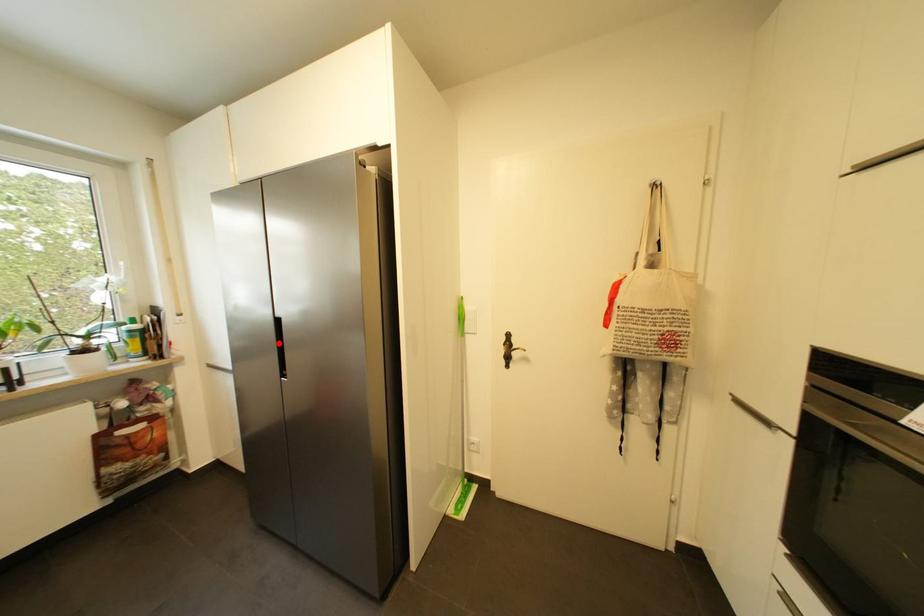
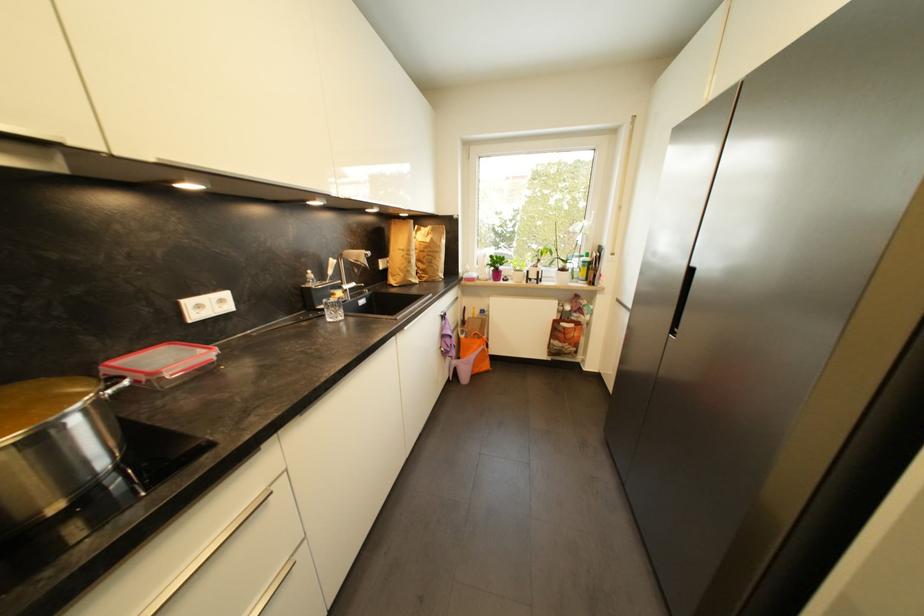
Question: I am providing you with two images of the same scene from different viewpoints. A red point is shown in image1. For the corresponding object point in image2, is it positioned nearer or farther from the camera?

Choices:
 (A) Nearer
 (B) Farther

Answer: (A)